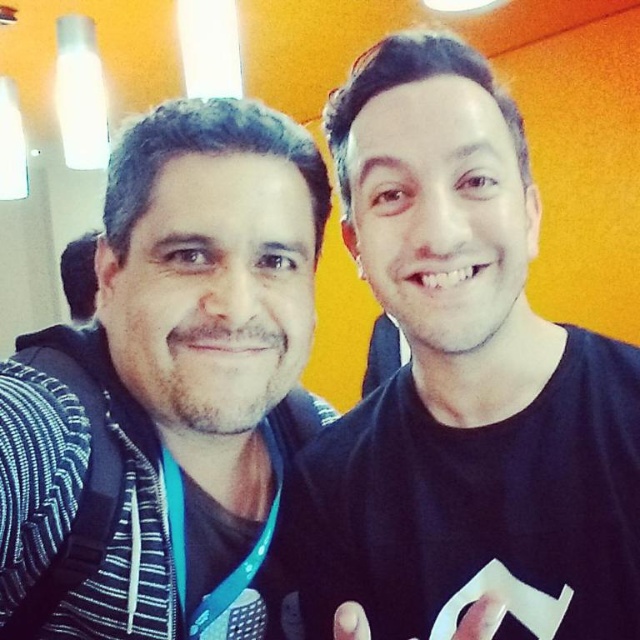
Does black matte t-shirt at right lie behind black striped hoodie at left?

No, it is not.

Is the position of black matte t-shirt at right less distant than that of black striped hoodie at left?

That is True.

The image size is (640, 640). What do you see at coordinates (461, 378) in the screenshot?
I see `black matte t-shirt at right` at bounding box center [461, 378].

Identify the location of black matte t-shirt at right. The width and height of the screenshot is (640, 640). (461, 378).